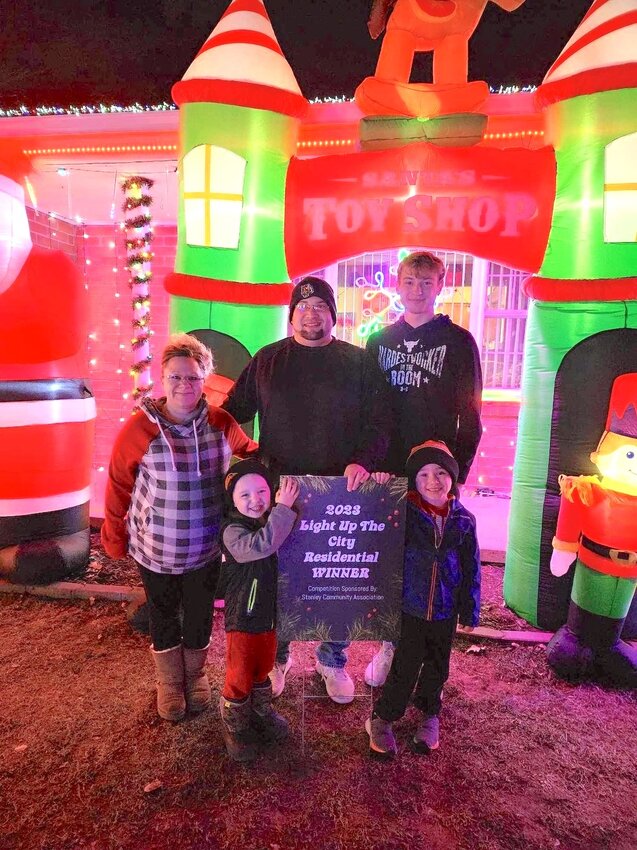
Where is `blinds`? This screenshot has width=637, height=850. blinds is located at coordinates (497, 286), (448, 286).